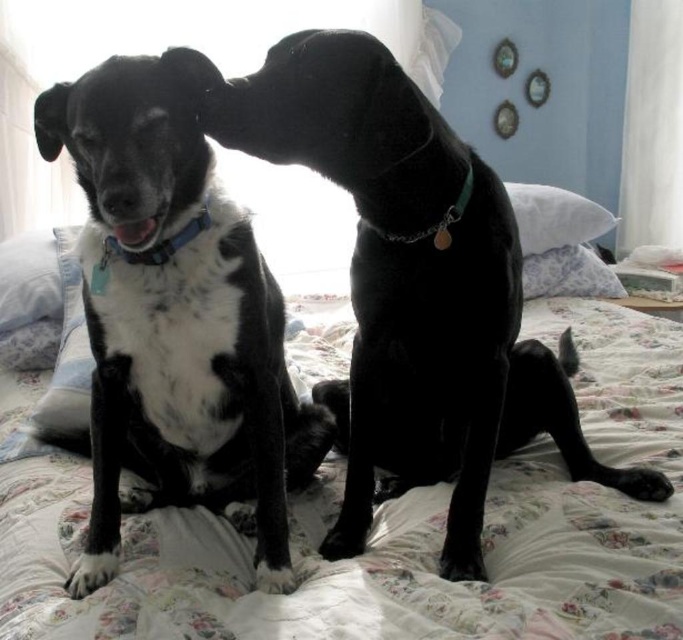
Question: Is black shiny dog at center smaller than black rubber nose at center?

Choices:
 (A) no
 (B) yes

Answer: (A)

Question: Considering the real-world distances, which object is farthest from the black rubber nose at center?

Choices:
 (A) black matte paw at lower right
 (B) black matte paw at lower center

Answer: (A)

Question: Is black matte paw at lower right in front of black rubber nose at center?

Choices:
 (A) yes
 (B) no

Answer: (B)

Question: Which object is the farthest from the black matte paw at lower right?

Choices:
 (A) black rubber nose at center
 (B) white soft paw at lower left
 (C) black matte paw at lower center
 (D) black fur dog at center

Answer: (B)

Question: Which is nearer to the white soft paw at lower left?

Choices:
 (A) black matte paw at lower center
 (B) black shiny dog at center

Answer: (A)

Question: Does floral quilted bed at center have a lesser width compared to white soft paw at lower left?

Choices:
 (A) no
 (B) yes

Answer: (A)